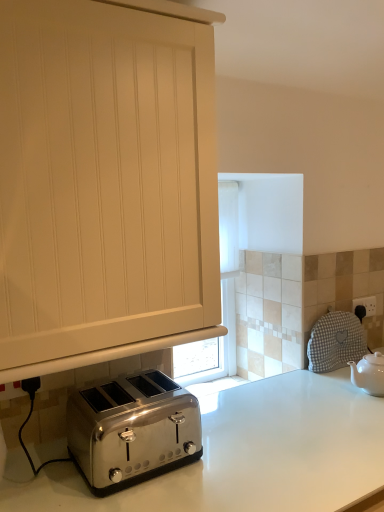
Where is `vacant region in front of satin silver toaster at lower left`? The image size is (384, 512). vacant region in front of satin silver toaster at lower left is located at coordinates (125, 498).